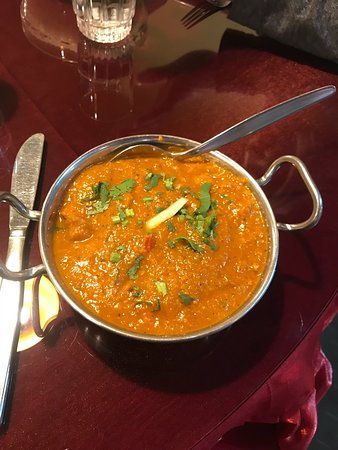
Where is `tabletop`? This screenshot has height=450, width=338. tabletop is located at coordinates (103, 393), (58, 130), (204, 83).